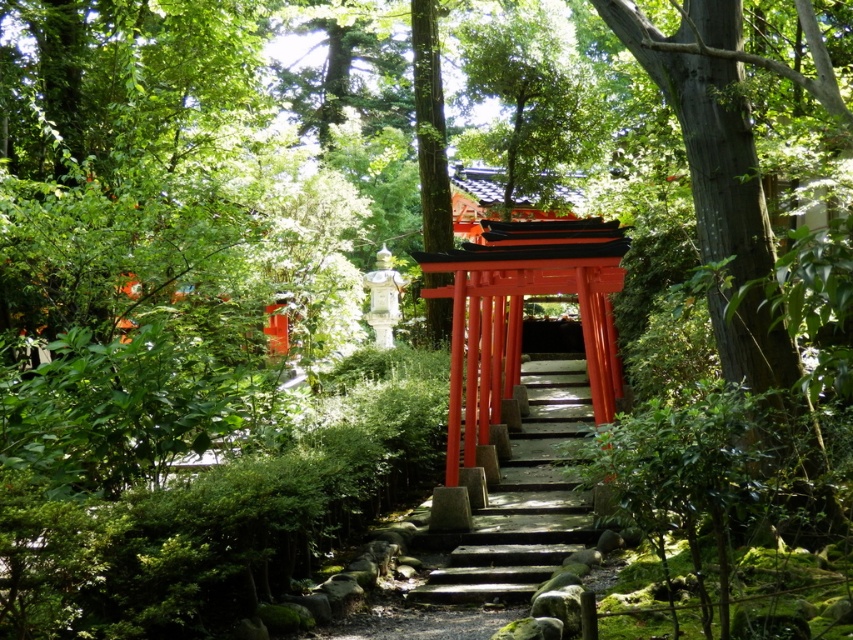
The height and width of the screenshot is (640, 853). Describe the element at coordinates (717, 173) in the screenshot. I see `smooth bark tree at right` at that location.

Does point (730, 58) come farther from viewer compared to point (561, 426)?

No, (730, 58) is in front of (561, 426).

Is point (781, 353) farther from viewer compared to point (527, 378)?

No, it is in front of (527, 378).

The height and width of the screenshot is (640, 853). Identify the location of smooth bark tree at right. (717, 173).